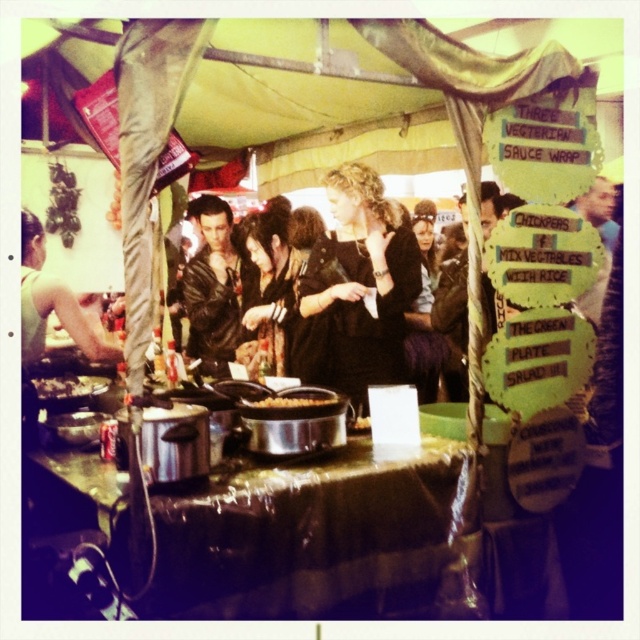
Question: Considering the relative positions of brown matte food at center and slightly browned metal pan at center in the image provided, where is brown matte food at center located with respect to slightly browned metal pan at center?

Choices:
 (A) right
 (B) left

Answer: (B)

Question: Is the position of black matte dress at center less distant than that of leather jacket at center?

Choices:
 (A) no
 (B) yes

Answer: (B)

Question: Which point is farther from the camera taking this photo?

Choices:
 (A) (364, 429)
 (B) (243, 401)

Answer: (A)

Question: Is leather jacket at center to the right of slightly browned metal pan at center from the viewer's perspective?

Choices:
 (A) no
 (B) yes

Answer: (A)

Question: Estimate the real-world distances between objects in this image. Which object is farther from the brown matte food at center?

Choices:
 (A) black matte dress at center
 (B) slightly browned metal pan at center
 (C) shiny black hair at center
 (D) leather jacket at center

Answer: (D)

Question: Which object is the farthest from the slightly browned metal pan at center?

Choices:
 (A) black matte dress at center
 (B) leather jacket at center
 (C) shiny black hair at center

Answer: (B)